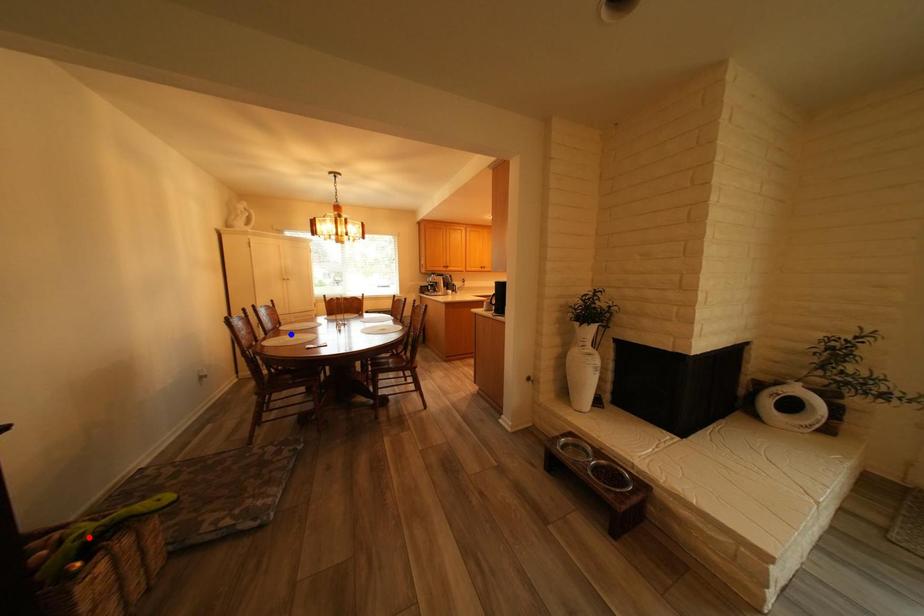
Question: Which of the two points in the image is closer to the camera?

Choices:
 (A) Blue point is closer.
 (B) Red point is closer.

Answer: (B)